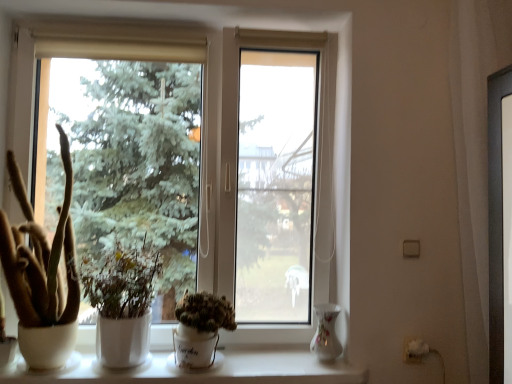
Question: Is transparent glass window at center outside of white matte plant at center, the 2th houseplant positioned from the left?

Choices:
 (A) yes
 (B) no

Answer: (A)

Question: Are transparent glass window at center and white matte plant at center, which ranks as the 2th houseplant in right-to-left order, far apart?

Choices:
 (A) yes
 (B) no

Answer: (B)

Question: From the image's perspective, would you say transparent glass window at center is positioned over white matte plant at center, the 2th houseplant positioned from the left?

Choices:
 (A) yes
 (B) no

Answer: (A)

Question: Is transparent glass window at center beside white matte plant at center, the 2th houseplant positioned from the left?

Choices:
 (A) yes
 (B) no

Answer: (B)

Question: Can you confirm if transparent glass window at center is thinner than white matte plant at center, which ranks as the 2th houseplant in right-to-left order?

Choices:
 (A) no
 (B) yes

Answer: (B)

Question: From the image's perspective, is transparent glass window at center located above or below white ceramic at lower center?

Choices:
 (A) below
 (B) above

Answer: (B)

Question: Considering the relative positions of transparent glass window at center and white ceramic at lower center in the image provided, is transparent glass window at center to the left or to the right of white ceramic at lower center?

Choices:
 (A) right
 (B) left

Answer: (B)

Question: In terms of width, does transparent glass window at center look wider or thinner when compared to white ceramic at lower center?

Choices:
 (A) thin
 (B) wide

Answer: (A)

Question: Is point (202, 36) closer or farther from the camera than point (92, 364)?

Choices:
 (A) farther
 (B) closer

Answer: (A)

Question: Does point (345, 160) appear closer or farther from the camera than point (212, 297)?

Choices:
 (A) farther
 (B) closer

Answer: (A)

Question: Based on their sizes in the image, would you say transparent glass window at center is bigger or smaller than green matte cactus at center, which appears as the first houseplant when viewed from the right?

Choices:
 (A) big
 (B) small

Answer: (A)

Question: Based on their positions, is transparent glass window at center located to the left or right of green matte cactus at center, the 3th houseplant viewed from the left?

Choices:
 (A) right
 (B) left

Answer: (B)

Question: From a real-world perspective, relative to green matte cactus at center, the 3th houseplant viewed from the left, is transparent glass window at center vertically above or below?

Choices:
 (A) below
 (B) above

Answer: (B)

Question: Considering the positions of point (108, 289) and point (315, 347), is point (108, 289) closer or farther from the camera than point (315, 347)?

Choices:
 (A) farther
 (B) closer

Answer: (B)

Question: From the image's perspective, is white matte plant at center, the 2th houseplant positioned from the left, located above or below porcelain floral vase at lower right?

Choices:
 (A) above
 (B) below

Answer: (A)